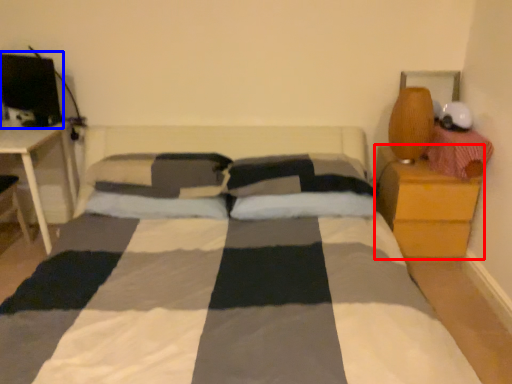
Question: Which object appears farthest to the camera in this image, nightstand (highlighted by a red box) or computer monitor (highlighted by a blue box)?

Choices:
 (A) nightstand
 (B) computer monitor

Answer: (A)